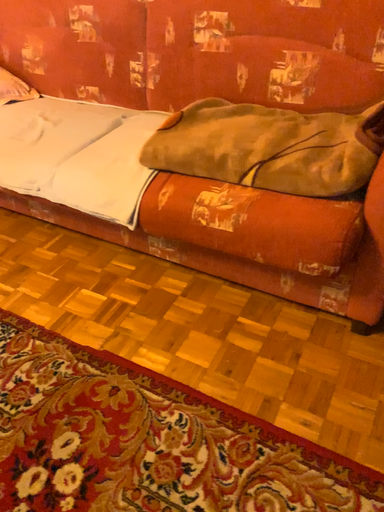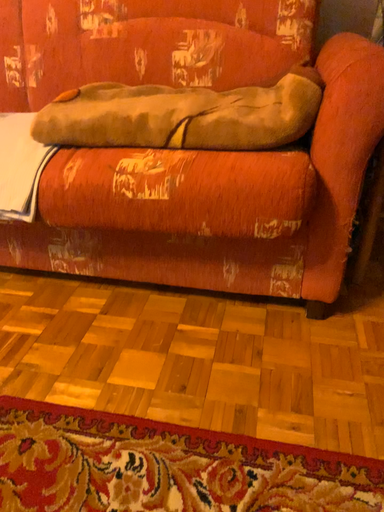
Question: How did the camera likely rotate when shooting the video?

Choices:
 (A) rotated upward
 (B) rotated downward

Answer: (A)